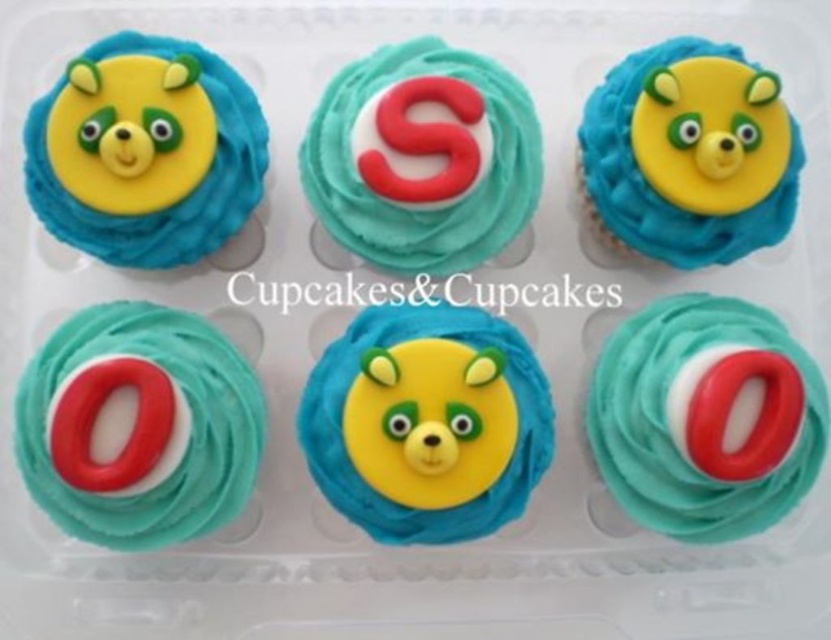
You are at the cupcake display and want to pick the matte yellow bear at upper left. Which direction should you move from the matte yellow bear at upper right to reach it?

To reach the matte yellow bear at upper left from the matte yellow bear at upper right, you should move to the left since the matte yellow bear at upper left is positioned to the left of the matte yellow bear at upper right.

You are trying to locate the yellow fondant bear at center in a cupcake tray. According to the coordinates given, where exactly is it positioned?

The yellow fondant bear at center is positioned at point 0.662 on the x axis and 0.514 on the y axis.